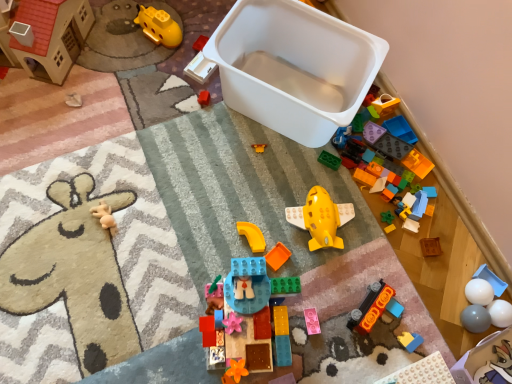
Where is `free space between beige rubber bear at left, which ranks as the 15th toy in right-to-left order, and white plastic tray at upper center, acting as the fourth toy starting from the left`? The height and width of the screenshot is (384, 512). free space between beige rubber bear at left, which ranks as the 15th toy in right-to-left order, and white plastic tray at upper center, acting as the fourth toy starting from the left is located at coordinates (154, 144).